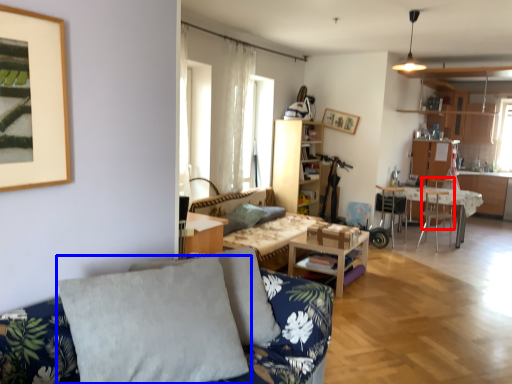
Question: Which of the following is the farthest to the observer, armchair (highlighted by a red box) or pillow (highlighted by a blue box)?

Choices:
 (A) armchair
 (B) pillow

Answer: (A)